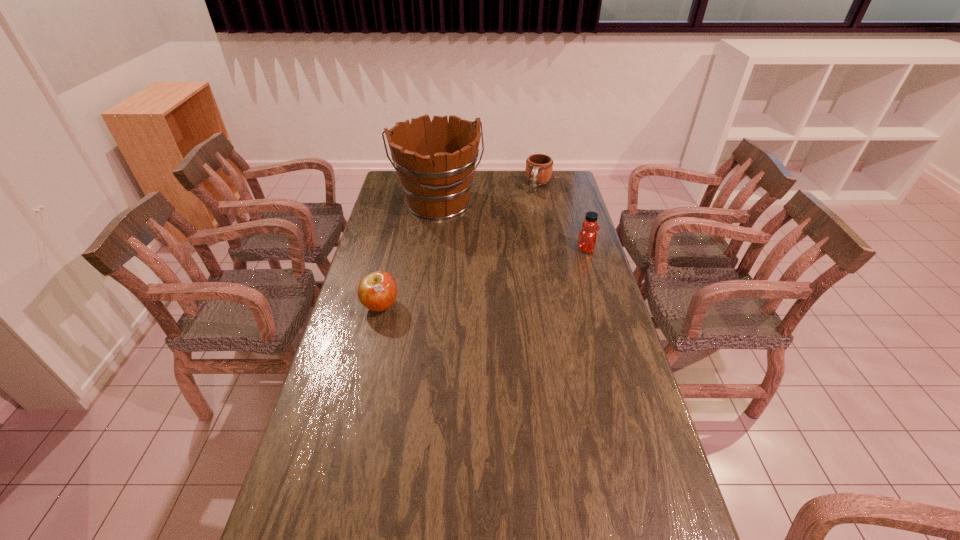
In the image, there is a desktop. In order to click on vacant space at the far edge in this screenshot , I will do `click(509, 174)`.

This screenshot has height=540, width=960. I want to click on vacant space at the left edge of the desktop, so click(x=385, y=327).

At what (x,y) coordinates should I click in order to perform the action: click on free space at the right edge of the desktop. Please return your answer as a coordinate pair (x, y). Looking at the image, I should click on (564, 212).

This screenshot has width=960, height=540. I want to click on vacant region at the far left corner of the desktop, so click(x=383, y=194).

This screenshot has width=960, height=540. In the image, there is a desktop. What are the coordinates of `vacant region at the near right corner` in the screenshot? It's located at (667, 511).

This screenshot has height=540, width=960. I want to click on free space between the third shortest object and the mug, so click(563, 217).

What are the coordinates of `free space between the apple and the second nearest object` in the screenshot? It's located at (483, 278).

Where is `free space between the second object from right to left and the rightmost object`? This screenshot has height=540, width=960. free space between the second object from right to left and the rightmost object is located at coordinates (563, 217).

This screenshot has height=540, width=960. I want to click on empty space that is in between the third object from left to right and the rightmost object, so click(563, 217).

At what (x,y) coordinates should I click in order to perform the action: click on vacant space that's between the third shortest object and the apple. Please return your answer as a coordinate pair (x, y). Looking at the image, I should click on (483, 278).